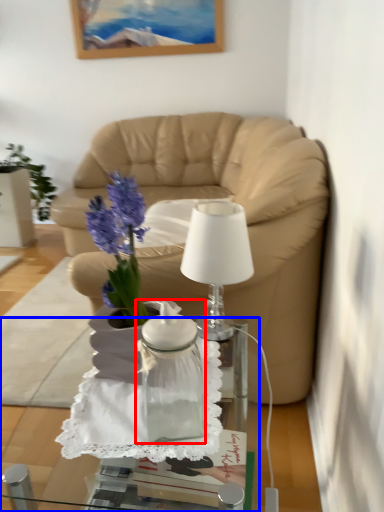
Question: Which of the following is the closest to the observer, vase (highlighted by a red box) or desk (highlighted by a blue box)?

Choices:
 (A) vase
 (B) desk

Answer: (B)